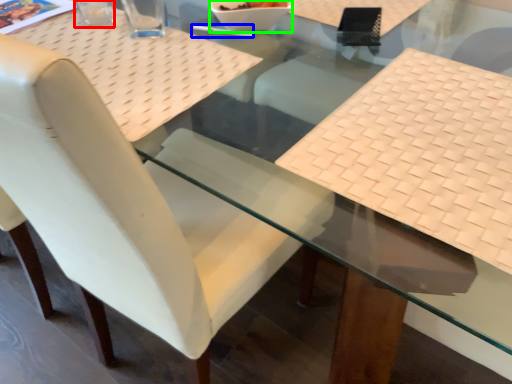
Question: Which object is the closest to the clear (highlighted by a red box)? Choose among these: chopstick (highlighted by a blue box) or glass bowl (highlighted by a green box).

Choices:
 (A) chopstick
 (B) glass bowl

Answer: (A)